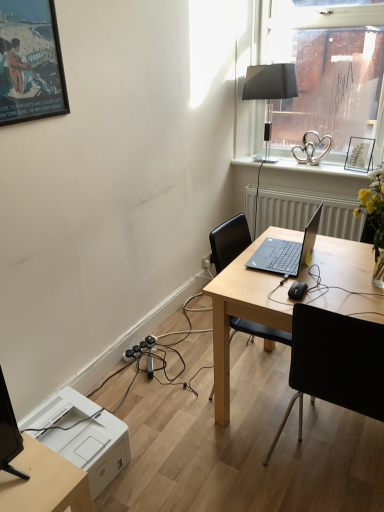
At what (x,y) coordinates should I click in order to perform the action: click on black fabric lampshade at upper right. Please return your answer as a coordinate pair (x, y). The width and height of the screenshot is (384, 512). Looking at the image, I should click on (270, 90).

Locate an element on the screen. The width and height of the screenshot is (384, 512). matte black picture frame at upper left, which ranks as the first picture frame in front-to-back order is located at coordinates (30, 62).

The image size is (384, 512). Describe the element at coordinates (315, 167) in the screenshot. I see `silver metallic heart at upper right` at that location.

Image resolution: width=384 pixels, height=512 pixels. In order to click on transparent glass window at upper right in this screenshot , I will do `click(325, 68)`.

What is the approximate width of light wood desk at center?

It is 76.03 centimeters.

Where is `black fabric lampshade at upper right`? The height and width of the screenshot is (512, 384). black fabric lampshade at upper right is located at coordinates (270, 90).

Which object is positioned more to the left, black fabric lampshade at upper right or matte black picture frame at upper left, which ranks as the first picture frame in front-to-back order?

matte black picture frame at upper left, which ranks as the first picture frame in front-to-back order.

Which object is further away from the camera taking this photo, black fabric lampshade at upper right or matte black picture frame at upper left, placed as the 2th picture frame when sorted from right to left?

black fabric lampshade at upper right is more distant.

From the image's perspective, is black fabric lampshade at upper right located above or below matte black picture frame at upper left, placed as the 2th picture frame when sorted from right to left?

From the image's perspective, black fabric lampshade at upper right appears above matte black picture frame at upper left, placed as the 2th picture frame when sorted from right to left.

In the scene shown: In terms of size, does black fabric lampshade at upper right appear bigger or smaller than matte black picture frame at upper left, the first picture frame positioned from the left?

Clearly, black fabric lampshade at upper right is larger in size than matte black picture frame at upper left, the first picture frame positioned from the left.

Is sleek black laptop at center at the back of matte black picture frame at upper right, the second picture frame from the left?

No, matte black picture frame at upper right, the second picture frame from the left, is not facing the opposite direction of sleek black laptop at center.

Is matte black picture frame at upper right, the second picture frame from the left, closer to camera compared to sleek black laptop at center?

No, matte black picture frame at upper right, the second picture frame from the left, is further to the viewer.

Can you see matte black picture frame at upper right, positioned as the second picture frame in front-to-back order, touching sleek black laptop at center?

matte black picture frame at upper right, positioned as the second picture frame in front-to-back order, and sleek black laptop at center are clearly separated.

Is matte black picture frame at upper right, the first picture frame viewed from the back, bigger than sleek black laptop at center?

Incorrect, matte black picture frame at upper right, the first picture frame viewed from the back, is not larger than sleek black laptop at center.

Considering the sizes of objects light wood desk at center and sleek black laptop at center in the image provided, who is wider, light wood desk at center or sleek black laptop at center?

With larger width is light wood desk at center.

From a real-world perspective, is light wood desk at center physically located above or below sleek black laptop at center?

In terms of real-world spatial position, light wood desk at center is below sleek black laptop at center.

Can you see light wood desk at center touching sleek black laptop at center?

No, light wood desk at center is not with sleek black laptop at center.

In the scene shown: Do you think black fabric lampshade at upper right is within matte black picture frame at upper right, the second picture frame from the left, or outside of it?

black fabric lampshade at upper right is not inside matte black picture frame at upper right, the second picture frame from the left, it's outside.

Is black fabric lampshade at upper right not close to matte black picture frame at upper right, positioned as the second picture frame in front-to-back order?

Actually, black fabric lampshade at upper right and matte black picture frame at upper right, positioned as the second picture frame in front-to-back order, are a little close together.

The image size is (384, 512). Find the location of `lamp behind the matte black picture frame at upper right, positioned as the second picture frame in front-to-back order`. lamp behind the matte black picture frame at upper right, positioned as the second picture frame in front-to-back order is located at coordinates (270, 90).

Is the position of black fabric lampshade at upper right less distant than that of matte black picture frame at upper right, the second picture frame from the left?

No, black fabric lampshade at upper right is further to the viewer.

Does transparent glass window at upper right lie behind matte black picture frame at upper right, positioned as the second picture frame in front-to-back order?

No.

In terms of width, does transparent glass window at upper right look wider or thinner when compared to matte black picture frame at upper right, the first picture frame viewed from the back?

In the image, transparent glass window at upper right appears to be wider than matte black picture frame at upper right, the first picture frame viewed from the back.

Does transparent glass window at upper right appear on the right side of matte black picture frame at upper right, positioned as the second picture frame in front-to-back order?

Incorrect, transparent glass window at upper right is not on the right side of matte black picture frame at upper right, positioned as the second picture frame in front-to-back order.

Locate an element on the screen. window on the left of matte black picture frame at upper right, which appears as the first picture frame when viewed from the right is located at coordinates (325, 68).

In terms of height, does transparent glass window at upper right look taller or shorter compared to black fabric chair at center?

Clearly, transparent glass window at upper right is taller compared to black fabric chair at center.

Who is more distant, transparent glass window at upper right or black fabric chair at center?

transparent glass window at upper right.

Is transparent glass window at upper right in contact with black fabric chair at center?

No, transparent glass window at upper right is not with black fabric chair at center.

How far apart are white plastic printer at lower left and black plastic mouse at lower right?

3.34 feet.

Can you confirm if white plastic printer at lower left is bigger than black plastic mouse at lower right?

Correct, white plastic printer at lower left is larger in size than black plastic mouse at lower right.

Does white plastic printer at lower left turn towards black plastic mouse at lower right?

No, white plastic printer at lower left does not turn towards black plastic mouse at lower right.

Is white plastic printer at lower left to the right of black plastic mouse at lower right from the viewer's perspective?

In fact, white plastic printer at lower left is to the left of black plastic mouse at lower right.

There is a black fabric lampshade at upper right. Where is `picture frame above it (from a real-world perspective)`? This screenshot has width=384, height=512. picture frame above it (from a real-world perspective) is located at coordinates (30, 62).

Where is `laptop in front of the matte black picture frame at upper right, which appears as the first picture frame when viewed from the right`? laptop in front of the matte black picture frame at upper right, which appears as the first picture frame when viewed from the right is located at coordinates (286, 251).

Based on their spatial positions, is black fabric chair at center or light wood desk at center further from transparent glass window at upper right?

black fabric chair at center.

When comparing their distances from light wood desk at center, does sleek black laptop at center or black plastic mouse at lower right seem further?

Based on the image, black plastic mouse at lower right appears to be further to light wood desk at center.

Looking at this image, considering their positions, is black plastic mouse at lower right positioned closer to silver metallic heart at upper right than white textured radiator at center?

Among the two, white textured radiator at center is located nearer to silver metallic heart at upper right.

Estimate the real-world distances between objects in this image. Which object is further from black plastic mouse at lower right, sleek black laptop at center or transparent glass window at upper right?

transparent glass window at upper right is positioned further to the anchor black plastic mouse at lower right.

Considering their positions, is light wood desk at center positioned closer to matte black picture frame at upper left, which ranks as the first picture frame in front-to-back order, than silver metallic heart at upper right?

light wood desk at center lies closer to matte black picture frame at upper left, which ranks as the first picture frame in front-to-back order, than the other object.

Estimate the real-world distances between objects in this image. Which object is closer to matte black picture frame at upper right, positioned as the second picture frame in front-to-back order, white plastic printer at lower left or black fabric chair at center?

black fabric chair at center is closer to matte black picture frame at upper right, positioned as the second picture frame in front-to-back order.

Looking at the image, which one is located further to silver metallic heart at upper right, white plastic printer at lower left or black plastic mouse at lower right?

Among the two, white plastic printer at lower left is located further to silver metallic heart at upper right.

Which object lies nearer to the anchor point black plastic mouse at lower right, transparent glass window at upper right or silver metallic heart at upper right?

silver metallic heart at upper right is closer to black plastic mouse at lower right.

I want to click on laptop between matte black picture frame at upper left, which ranks as the first picture frame in front-to-back order, and matte black picture frame at upper right, the first picture frame viewed from the back, in the horizontal direction, so click(x=286, y=251).

This screenshot has width=384, height=512. I want to click on desk between black fabric lampshade at upper right and white plastic printer at lower left from top to bottom, so click(x=245, y=310).

This screenshot has height=512, width=384. In order to click on computer mouse between light wood desk at center and silver metallic heart at upper right from front to back in this screenshot , I will do `click(297, 290)`.

This screenshot has width=384, height=512. I want to click on lamp positioned between black plastic mouse at lower right and silver metallic heart at upper right from near to far, so click(x=270, y=90).